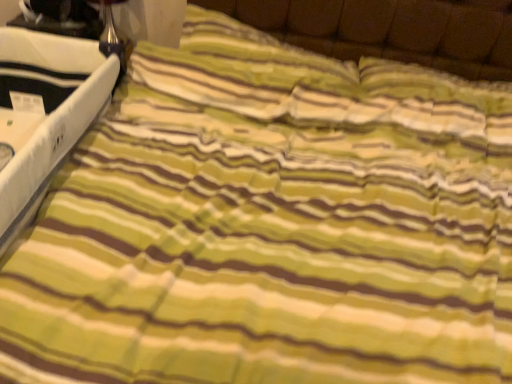
This screenshot has width=512, height=384. What do you see at coordinates (113, 36) in the screenshot? I see `metallic silver table lamp at upper left` at bounding box center [113, 36].

The width and height of the screenshot is (512, 384). In order to click on metallic silver table lamp at upper left in this screenshot , I will do `click(113, 36)`.

Where is `metallic silver table lamp at upper left`? This screenshot has width=512, height=384. metallic silver table lamp at upper left is located at coordinates (113, 36).